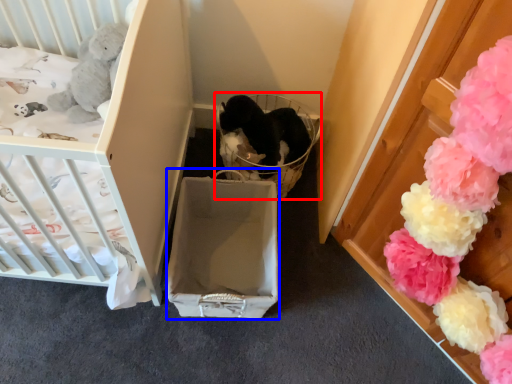
Question: Which point is closer to the camera, baby carriage (highlighted by a red box) or cardboard box (highlighted by a blue box)?

Choices:
 (A) baby carriage
 (B) cardboard box

Answer: (B)